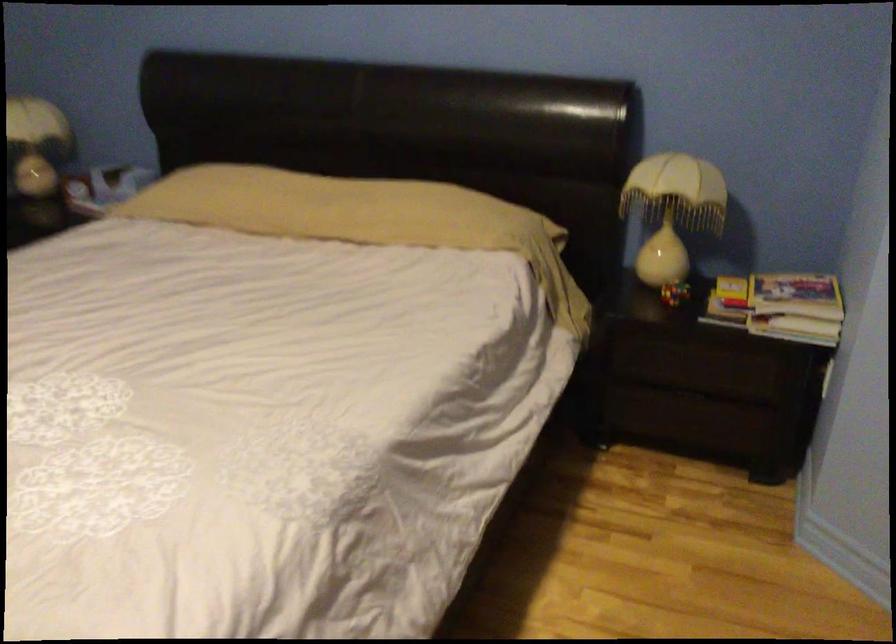
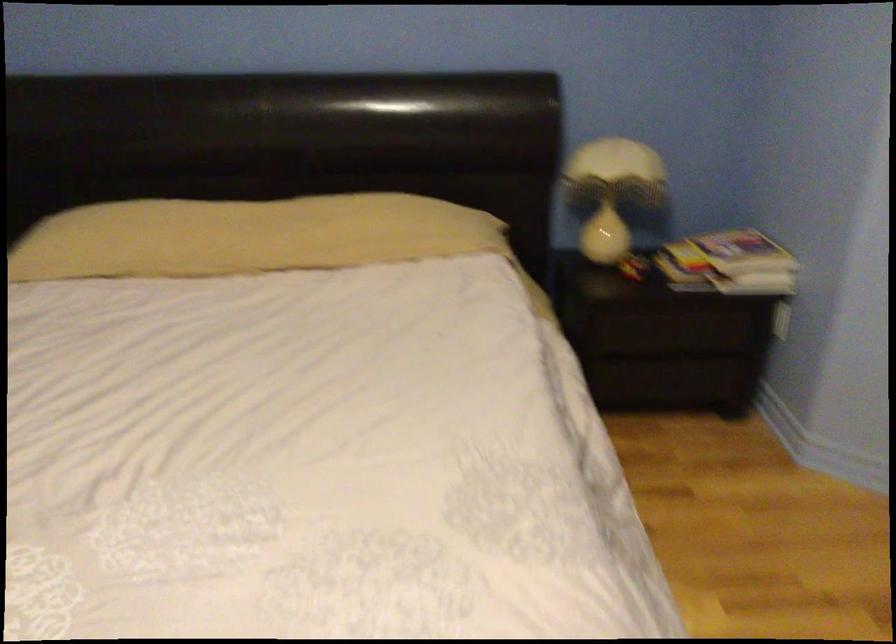
In the second image, find the point that corresponds to [760,308] in the first image.

(728, 263)